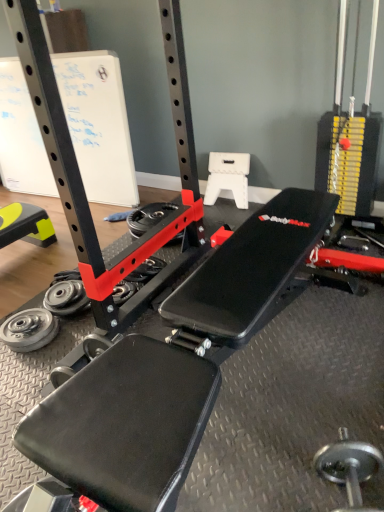
Question: Is silver metallic dumbbell at lower right smaller than silver metallic weight at lower left, marked as the 2th wheel in a front-to-back arrangement?

Choices:
 (A) no
 (B) yes

Answer: (A)

Question: From a real-world perspective, is silver metallic dumbbell at lower right physically above silver metallic weight at lower left, the 2th wheel from the right?

Choices:
 (A) no
 (B) yes

Answer: (B)

Question: From a real-world perspective, is silver metallic dumbbell at lower right beneath silver metallic weight at lower left, which ranks as the 2th wheel in back-to-front order?

Choices:
 (A) yes
 (B) no

Answer: (B)

Question: Does silver metallic dumbbell at lower right have a greater width compared to silver metallic weight at lower left, marked as the 2th wheel in a left-to-right arrangement?

Choices:
 (A) yes
 (B) no

Answer: (A)

Question: Is silver metallic dumbbell at lower right aimed at silver metallic weight at lower left, the 2th wheel from the right?

Choices:
 (A) yes
 (B) no

Answer: (B)

Question: Does silver metallic dumbbell at lower right have a larger size compared to silver metallic weight at lower left, which ranks as the 2th wheel in back-to-front order?

Choices:
 (A) no
 (B) yes

Answer: (B)

Question: Is silver metallic weight at lower left, which ranks as the 2th wheel in back-to-front order, located outside yellow rubber mat at lower left?

Choices:
 (A) yes
 (B) no

Answer: (A)

Question: Is silver metallic weight at lower left, which is the 2th wheel from top to bottom, with yellow rubber mat at lower left?

Choices:
 (A) yes
 (B) no

Answer: (B)

Question: Can you confirm if silver metallic weight at lower left, marked as the 2th wheel in a left-to-right arrangement, is positioned to the left of yellow rubber mat at lower left?

Choices:
 (A) yes
 (B) no

Answer: (B)

Question: Are silver metallic weight at lower left, marked as the 2th wheel in a left-to-right arrangement, and yellow rubber mat at lower left far apart?

Choices:
 (A) yes
 (B) no

Answer: (B)

Question: Could you tell me if silver metallic weight at lower left, the 2th wheel from the right, is turned towards yellow rubber mat at lower left?

Choices:
 (A) no
 (B) yes

Answer: (B)

Question: From a real-world perspective, is silver metallic weight at lower left, marked as the 2th wheel in a front-to-back arrangement, on yellow rubber mat at lower left?

Choices:
 (A) yes
 (B) no

Answer: (B)

Question: From the image's perspective, is white paperboard at upper left located beneath silver metallic weight at lower left, marked as the 2th wheel in a front-to-back arrangement?

Choices:
 (A) no
 (B) yes

Answer: (A)